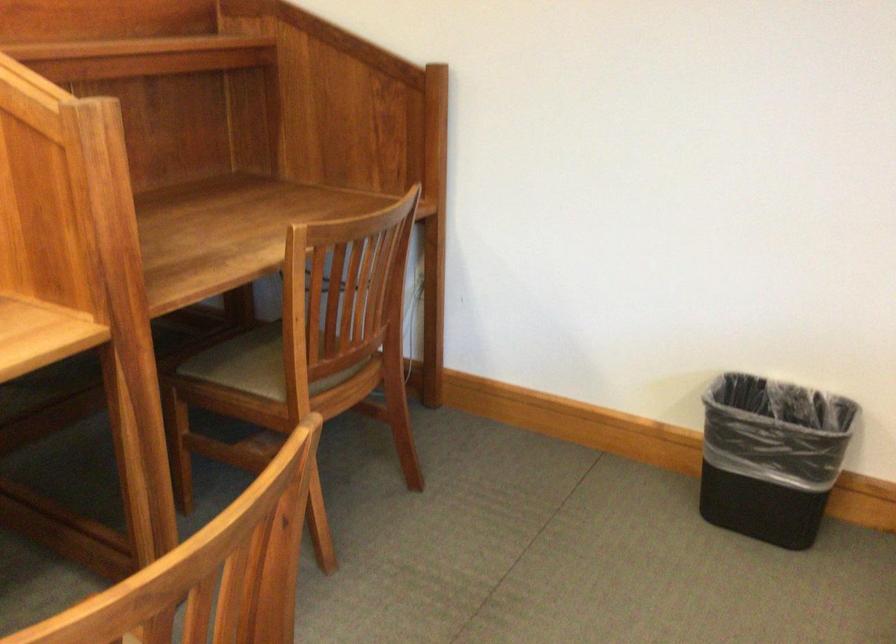
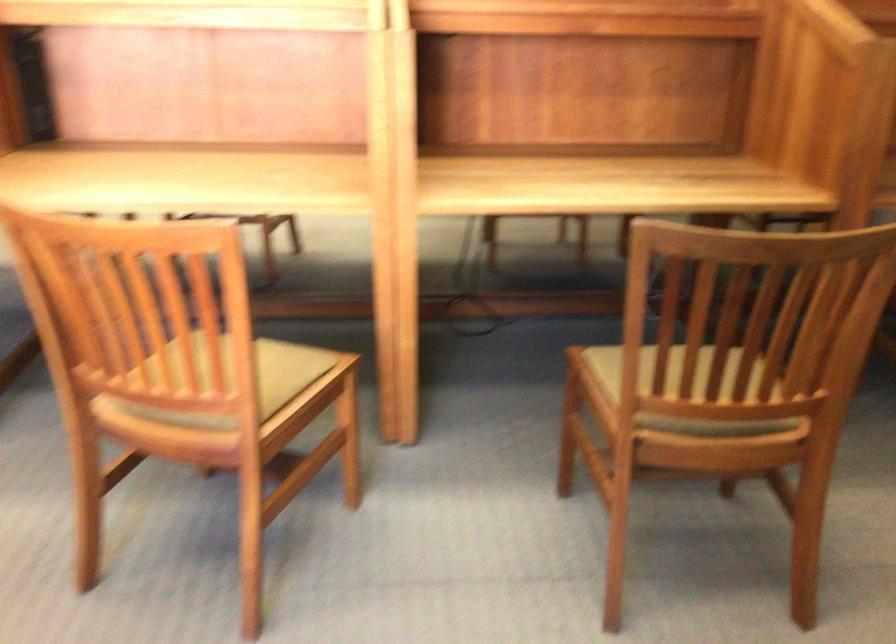
Question: The first image is from the beginning of the video and the second image is from the end. How did the camera likely rotate when shooting the video?

Choices:
 (A) Left
 (B) Right
 (C) Up
 (D) Down

Answer: (A)